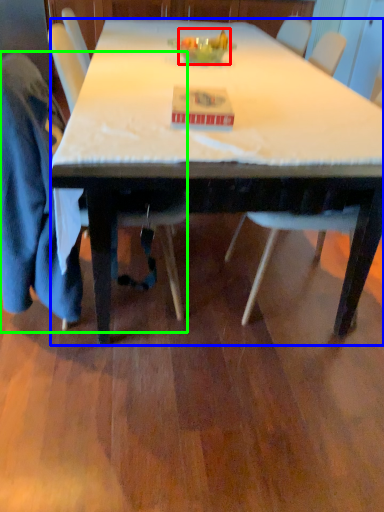
Question: Which object is positioned farthest from food (highlighted by a red box)? Select from desk (highlighted by a blue box) and chair (highlighted by a green box).

Choices:
 (A) desk
 (B) chair

Answer: (B)